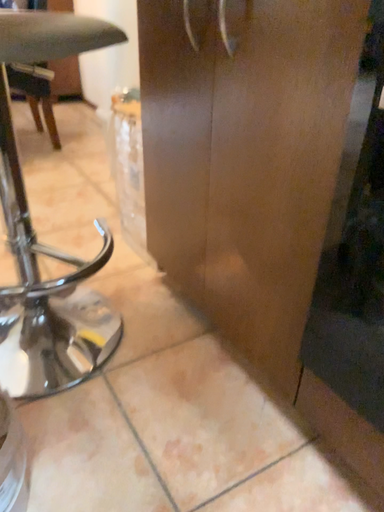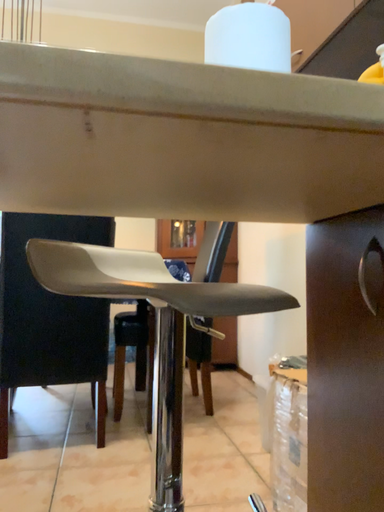
Question: How did the camera likely rotate when shooting the video?

Choices:
 (A) rotated downward
 (B) rotated upward

Answer: (B)